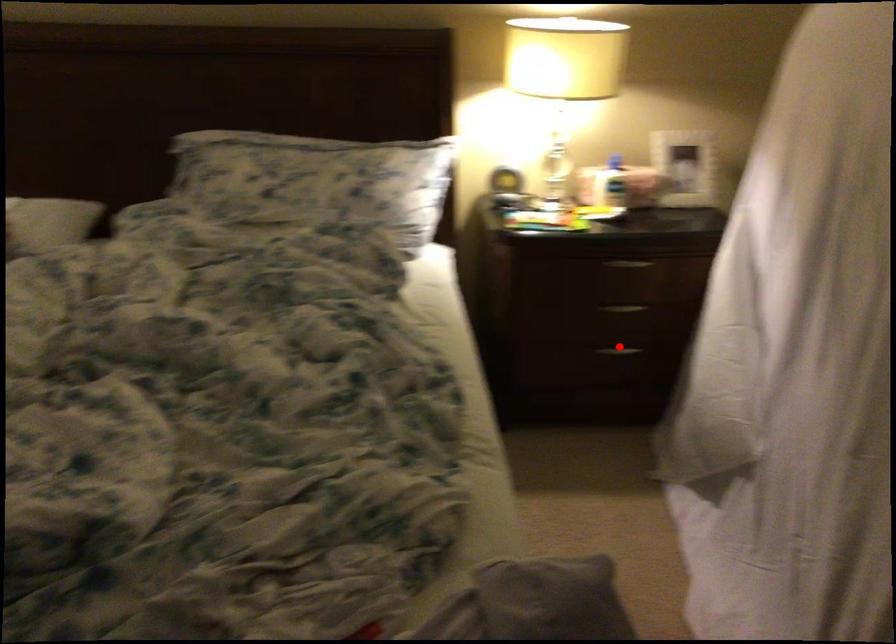
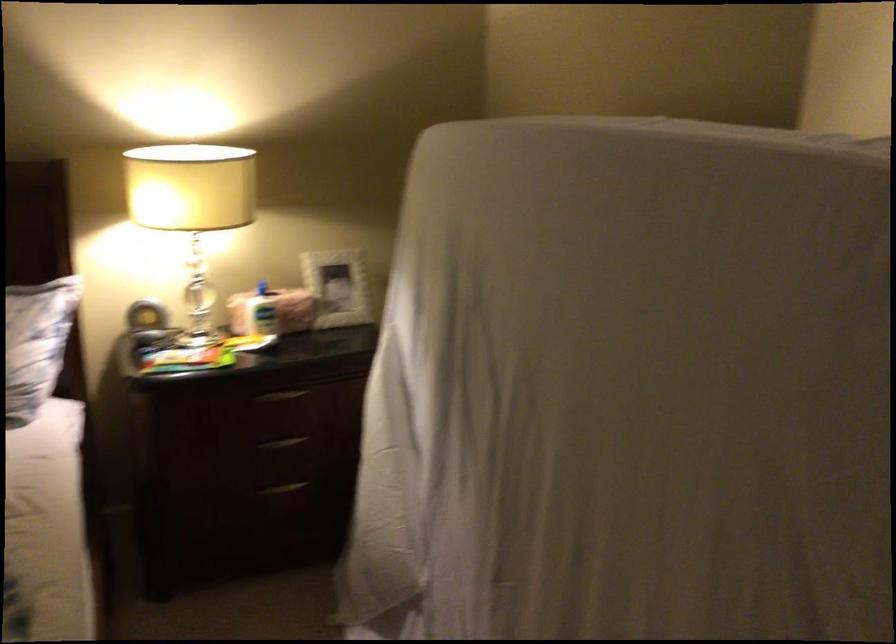
The point at the highlighted location is marked in the first image. Where is the corresponding point in the second image?

(283, 488)